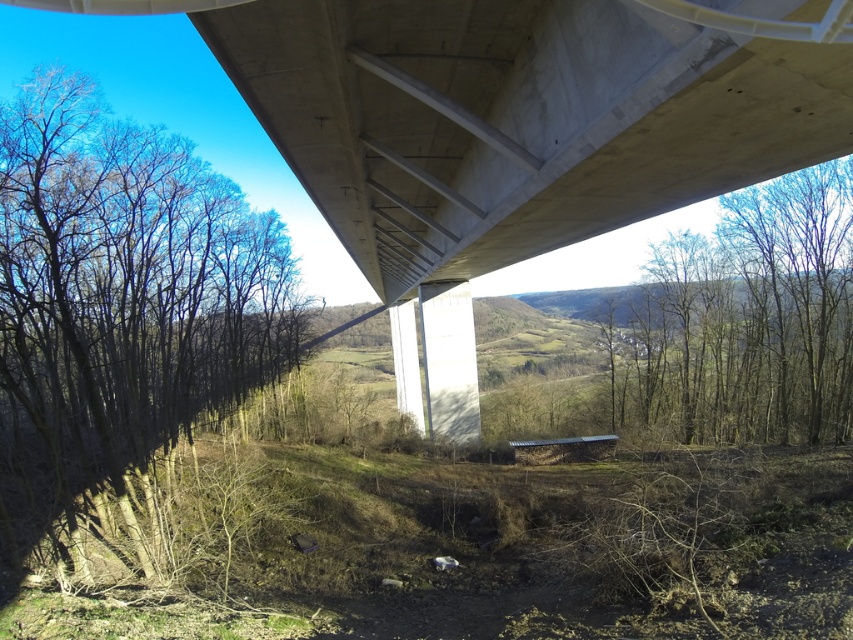
Question: Which of these objects is positioned closest to the bare branches at left?

Choices:
 (A) bare wood trees at upper right
 (B) concrete at upper center

Answer: (B)

Question: Is bare branches at left below bare wood trees at upper right?

Choices:
 (A) yes
 (B) no

Answer: (B)

Question: Which is nearer to the bare branches at left?

Choices:
 (A) concrete at upper center
 (B) bare wood trees at upper right

Answer: (A)

Question: Which object is farther from the camera taking this photo?

Choices:
 (A) bare wood trees at upper right
 (B) bare branches at left

Answer: (A)

Question: Can you confirm if concrete at upper center is positioned to the right of bare wood trees at upper right?

Choices:
 (A) no
 (B) yes

Answer: (A)

Question: Is concrete at upper center behind bare wood trees at upper right?

Choices:
 (A) yes
 (B) no

Answer: (B)